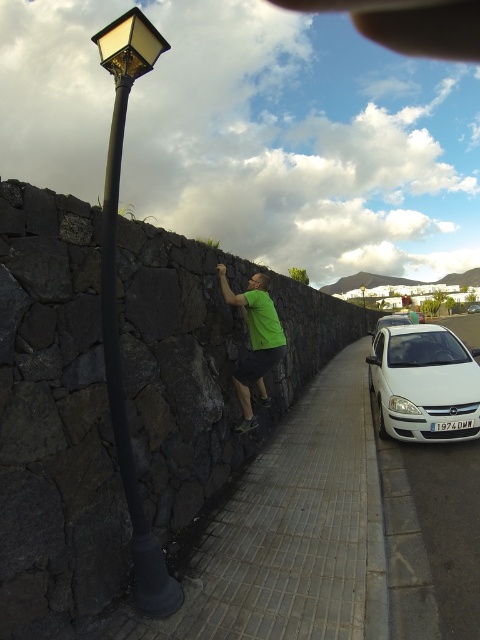
You are driving a white glossy sedan at right and need to park it near the matte black street light at left. Can you park the sedan so that it faces the street light?

The matte black street light at left is positioned on the left side of the white glossy sedan at right. Therefore, you can park the white glossy sedan at right facing towards the matte black street light at left as they are positioned next to each other with the sedan on the right side of the lamppost.

From the picture: You are a photographer setting up a tripod to capture the scene with the green matte shirt at center and the white glossy sedan at right. Based on their sizes in the image, which object should you focus on first if you want to ensure both are in focus without adjusting the camera settings?

The green matte shirt at center is taller than the white glossy sedan at right. Since the shirt is taller, focusing on it first would help ensure both are in focus as it requires a closer attention due to its height.